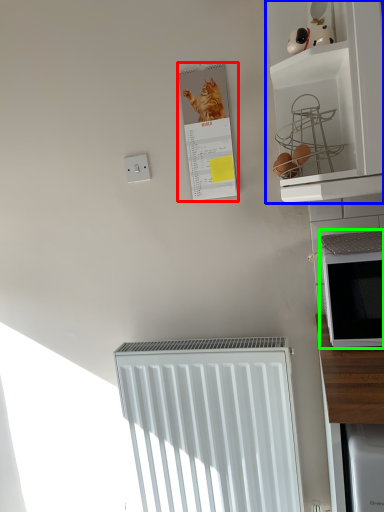
Question: Which object is positioned closest to bulletin board (highlighted by a red box)? Select from shelf (highlighted by a blue box) and microwave oven (highlighted by a green box).

Choices:
 (A) shelf
 (B) microwave oven

Answer: (A)